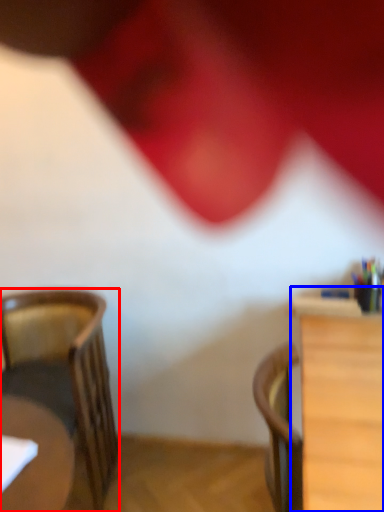
Question: Which point is closer to the camera, chair (highlighted by a red box) or table (highlighted by a blue box)?

Choices:
 (A) chair
 (B) table

Answer: (B)